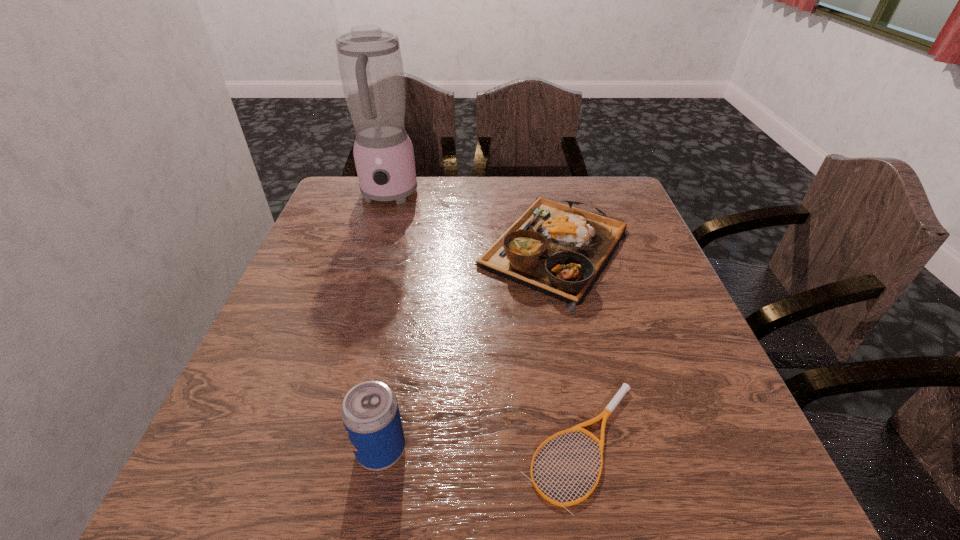
I want to click on food processor, so click(370, 63).

Where is `the second tallest object`? the second tallest object is located at coordinates (370, 413).

You are a GUI agent. You are given a task and a screenshot of the screen. Output one action in this format:
    pyautogui.click(x=<x>, y=<y>)
    Task: Click on the third tallest object
    
    Given the screenshot: What is the action you would take?
    pyautogui.click(x=559, y=250)

The image size is (960, 540). I want to click on the shortest object, so click(606, 413).

Find the location of `free location located 0.070m on the base of the tallest object near the control knob`. free location located 0.070m on the base of the tallest object near the control knob is located at coordinates (378, 231).

Identify the location of vacant space situated 0.050m on the right of the beer can. The width and height of the screenshot is (960, 540). (439, 450).

This screenshot has height=540, width=960. I want to click on vacant area located on the left of the platter, so click(x=430, y=247).

The image size is (960, 540). Find the location of `free location located 0.300m on the left of the shortest object`. free location located 0.300m on the left of the shortest object is located at coordinates (326, 444).

Locate an element on the screen. food processor present at the far edge is located at coordinates (370, 63).

You are a GUI agent. You are given a task and a screenshot of the screen. Output one action in this format:
    pyautogui.click(x=<x>, y=<y>)
    Task: Click on the platter at the far edge
    The width and height of the screenshot is (960, 540).
    Given the screenshot: What is the action you would take?
    pyautogui.click(x=559, y=250)